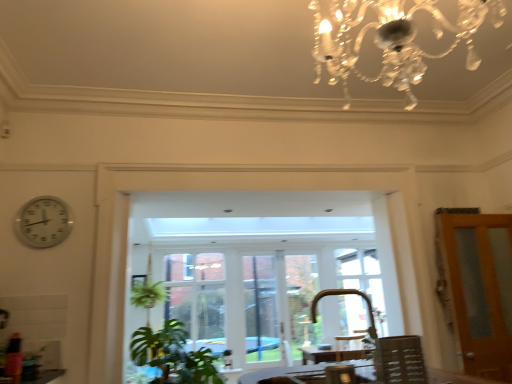
Question: From a real-world perspective, is brown wooden door at right physically located above or below wooden table at lower center?

Choices:
 (A) above
 (B) below

Answer: (A)

Question: Relative to wooden table at lower center, is brown wooden door at right in front or behind?

Choices:
 (A) behind
 (B) front

Answer: (A)

Question: Which is farther from the wooden table at lower center?

Choices:
 (A) white wood window frame at center
 (B) wooden chair at lower right
 (C) clear glass window at center
 (D) white plastic clock at left
 (E) gold metallic faucet at lower center

Answer: (C)

Question: Which of these objects is positioned closest to the wooden table at lower center?

Choices:
 (A) brown wooden door at right
 (B) clear glass window at center
 (C) wooden chair at lower right
 (D) white plastic clock at left
 (E) white wood window frame at center

Answer: (A)